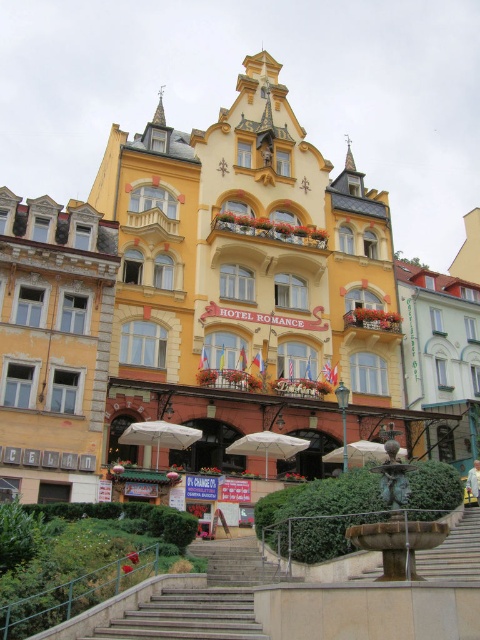
Question: Does brown stone stairs at lower center have a larger size compared to white fabric umbrella at center?

Choices:
 (A) yes
 (B) no

Answer: (B)

Question: Among these points, which one is nearest to the camera?

Choices:
 (A) (181, 632)
 (B) (163, 436)

Answer: (A)

Question: Which point is farther to the camera?

Choices:
 (A) brown stone stairs at lower center
 (B) white fabric umbrella at center
 (C) white matte umbrella at lower center

Answer: (C)

Question: Which object is farther from the camera taking this photo?

Choices:
 (A) gray concrete stairs at lower center
 (B) white matte umbrella at center

Answer: (B)

Question: Can you confirm if white matte building at right is positioned to the right of gray concrete stairs at lower center?

Choices:
 (A) yes
 (B) no

Answer: (A)

Question: Is white matte umbrella at lower center above white fabric umbrella at center?

Choices:
 (A) yes
 (B) no

Answer: (A)